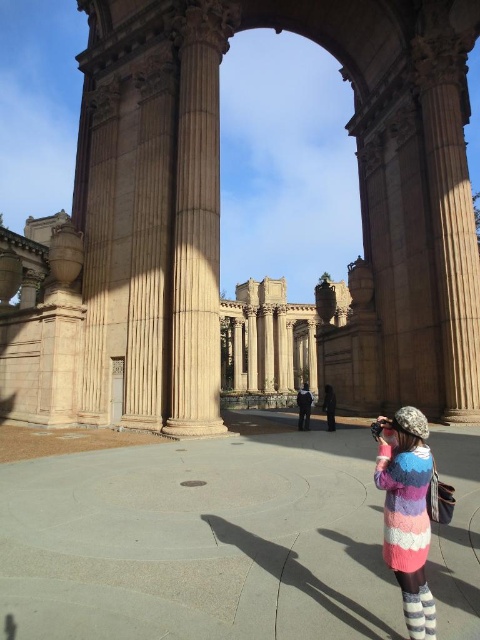
Question: Which of the following is the farthest from the observer?

Choices:
 (A) (302, 388)
 (B) (183, 273)

Answer: (A)

Question: Can you confirm if multicolored knitted sweater at lower right is positioned to the left of dark woolen sweater at center?

Choices:
 (A) yes
 (B) no

Answer: (B)

Question: Can you confirm if multicolored knitted sweater at lower right is thinner than dark woolen sweater at center?

Choices:
 (A) yes
 (B) no

Answer: (B)

Question: Considering the real-world distances, which object is closest to the brown stone ruins at center?

Choices:
 (A) multicolored knitted sweater at lower right
 (B) dark woolen sweater at center
 (C) dark blue fabric jacket at center

Answer: (B)

Question: Is brown stone ruins at center behind dark woolen sweater at center?

Choices:
 (A) yes
 (B) no

Answer: (B)

Question: Which of the following is the closest to the observer?

Choices:
 (A) (37, 355)
 (B) (389, 422)
 (C) (219, 369)

Answer: (B)